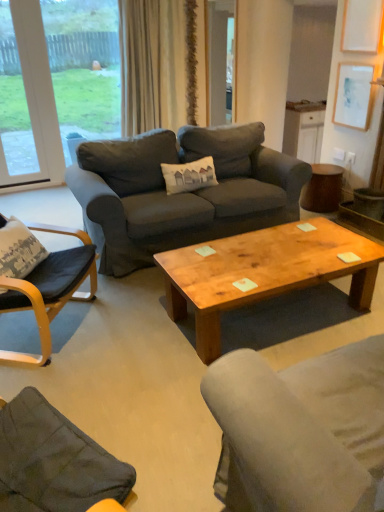
The width and height of the screenshot is (384, 512). Identify the location of vacant area to the left of wooden coffee table at center. (125, 338).